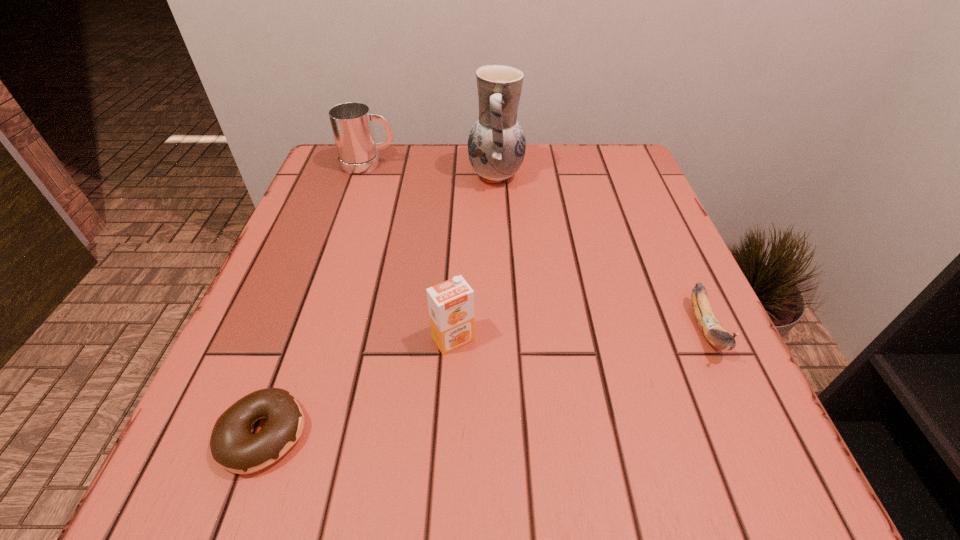
I want to click on object positioned at the far left corner, so click(351, 122).

You are a GUI agent. You are given a task and a screenshot of the screen. Output one action in this format:
    pyautogui.click(x=<x>, y=<y>)
    Task: Click on the object positioned at the near left corner
    The image size is (960, 540).
    Given the screenshot: What is the action you would take?
    tap(234, 447)

Where is `vacant space at the far edge of the desktop`? The image size is (960, 540). vacant space at the far edge of the desktop is located at coordinates (430, 171).

Image resolution: width=960 pixels, height=540 pixels. In the image, there is a desktop. Identify the location of blank space at the near edge. (411, 487).

In the image, there is a desktop. Identify the location of free space at the left edge. Image resolution: width=960 pixels, height=540 pixels. (360, 249).

At what (x,y) coordinates should I click in order to perform the action: click on vacant space at the right edge of the desktop. Please return your answer as a coordinate pair (x, y). The image size is (960, 540). Looking at the image, I should click on (622, 342).

The width and height of the screenshot is (960, 540). In the image, there is a desktop. Find the location of `vacant space at the near right corner`. vacant space at the near right corner is located at coordinates (748, 494).

I want to click on vacant space in between the orange juice and the rightmost object, so click(580, 334).

Where is `empty space between the mug and the orange juice`? Image resolution: width=960 pixels, height=540 pixels. empty space between the mug and the orange juice is located at coordinates (411, 252).

This screenshot has width=960, height=540. Find the location of `vacant area that lies between the mug and the tallest object`. vacant area that lies between the mug and the tallest object is located at coordinates (432, 170).